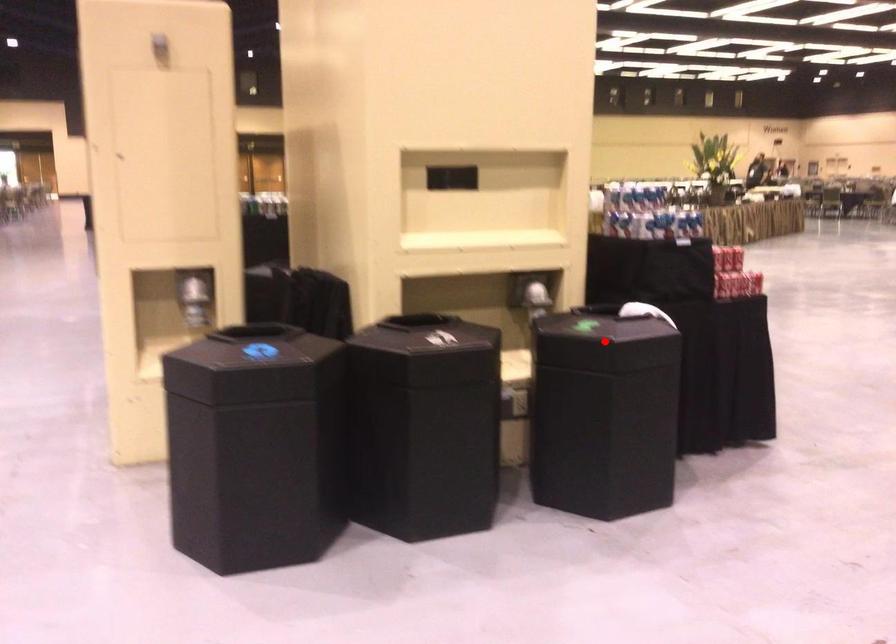
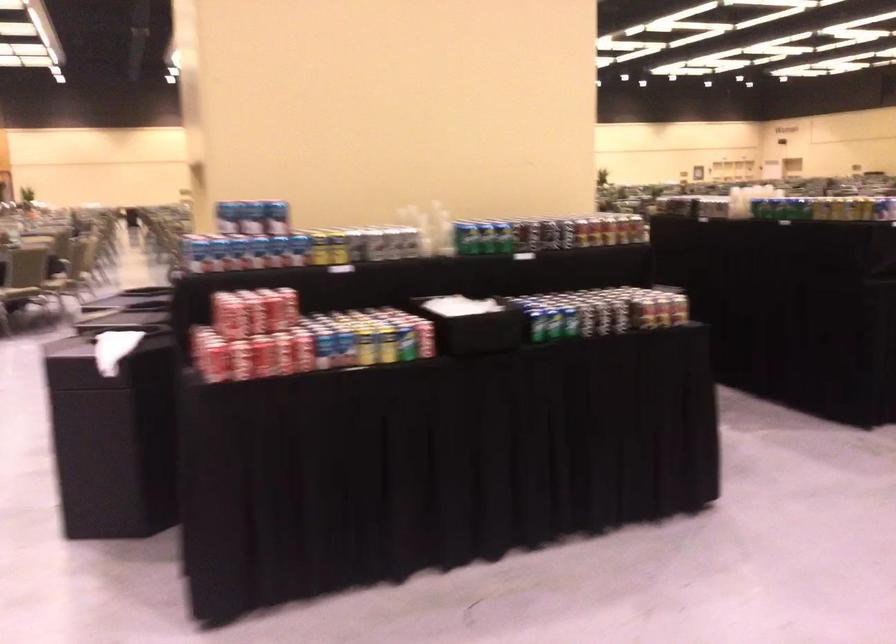
Question: I am providing you with two images of the same scene from different viewpoints. A red point is marked on the first image. At the location where the point appears in image 1, is it still visible in image 2?

Choices:
 (A) Yes
 (B) No

Answer: (B)